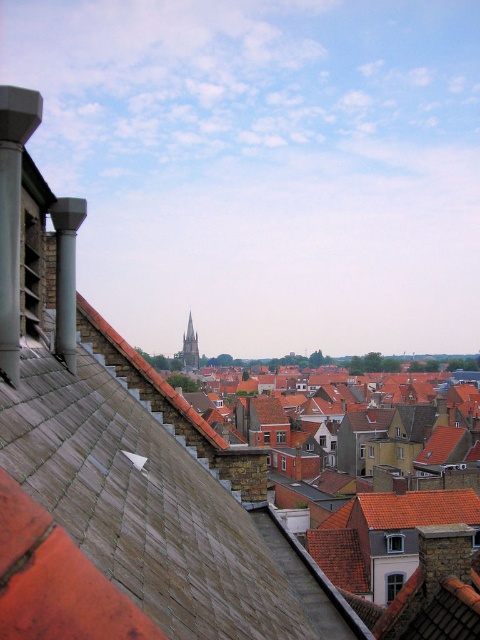
Can you confirm if brown tiled roofs at center is positioned to the right of smooth gray stone tower at center?

Yes, brown tiled roofs at center is to the right of smooth gray stone tower at center.

Find the location of a particular element. brown tiled roofs at center is located at coordinates (408, 561).

At what (x,y) coordinates should I click in order to perform the action: click on brown tiled roofs at center. Please return your answer as a coordinate pair (x, y). Looking at the image, I should click on (408, 561).